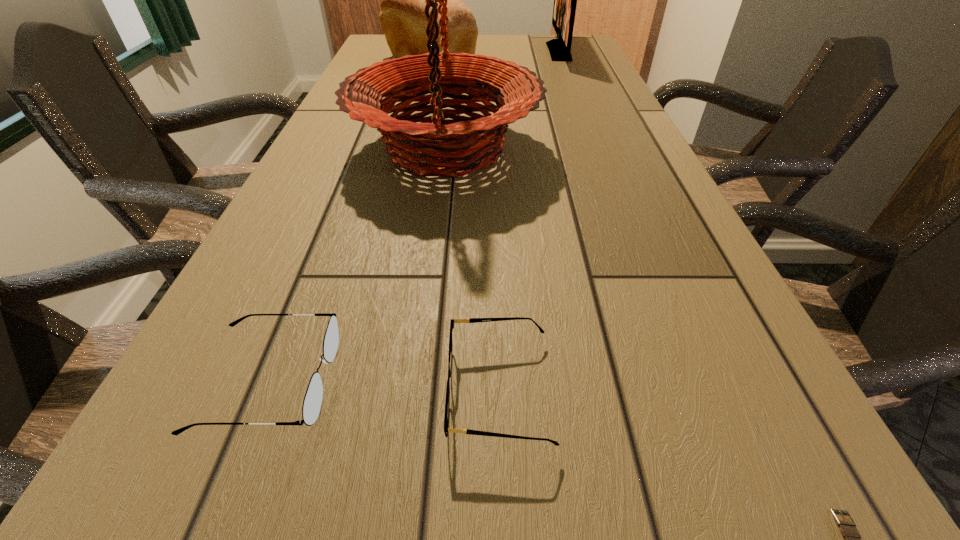
Where is `spectacles located at the left edge`? spectacles located at the left edge is located at coordinates (312, 403).

Identify the location of object located at the right edge. This screenshot has height=540, width=960. (565, 0).

Find the location of a particular element. This screenshot has width=960, height=540. object that is at the far left corner is located at coordinates (402, 18).

Where is `object at the far right corner`? object at the far right corner is located at coordinates (565, 0).

Identify the location of vacant space at the far edge of the desktop. The width and height of the screenshot is (960, 540). (504, 46).

Identify the location of vacant space at the left edge. The image size is (960, 540). (252, 487).

The width and height of the screenshot is (960, 540). Find the location of `vacant area at the right edge of the desktop`. vacant area at the right edge of the desktop is located at coordinates (599, 165).

Locate an element on the screen. This screenshot has width=960, height=540. vacant space that's between the left spectacles and the third tallest object is located at coordinates (349, 222).

You are a GUI agent. You are given a task and a screenshot of the screen. Output one action in this format:
    pyautogui.click(x=<x>, y=<y>)
    Task: Click on the vacant area between the third tallest object and the right spectacles
    The image size is (960, 540).
    Given the screenshot: What is the action you would take?
    pyautogui.click(x=465, y=228)

Where is `unoccupied area between the basket and the left spectacles`? unoccupied area between the basket and the left spectacles is located at coordinates (357, 265).